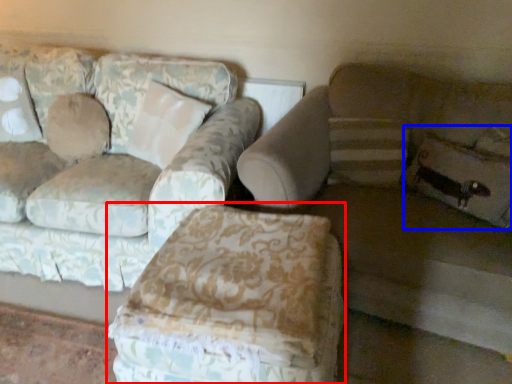
Question: Among these objects, which one is nearest to the camera, swivel chair (highlighted by a red box) or pillow (highlighted by a blue box)?

Choices:
 (A) swivel chair
 (B) pillow

Answer: (A)